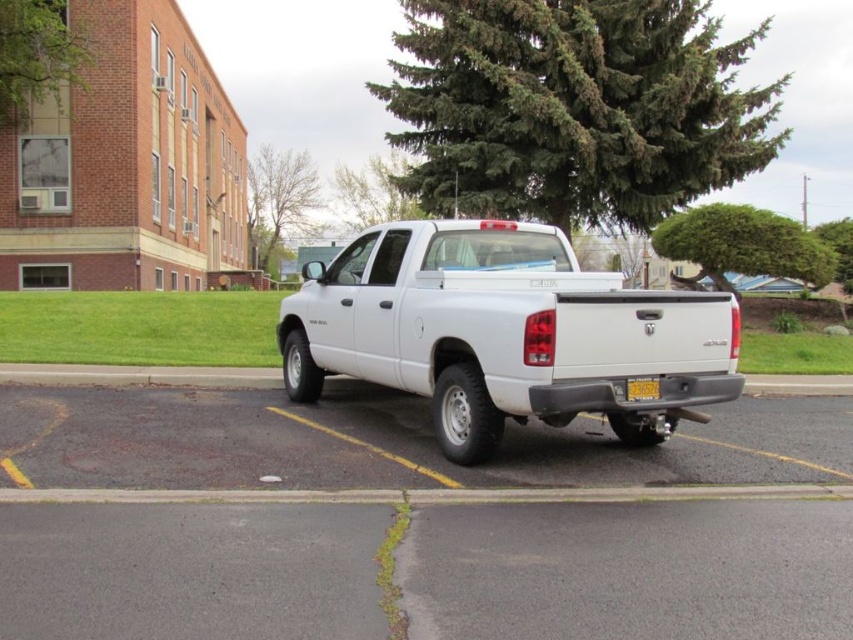
In the scene shown: You are a photographer trying to capture the green leafy bush at upper right and the yellow matte license plate at rear in a single frame. Based on their sizes, which object should you focus on to ensure both fit in the photo without cropping?

The green leafy bush at upper right has a larger width than the yellow matte license plate at rear, so you should focus on capturing the green leafy bush at upper right first to ensure both fit in the frame.